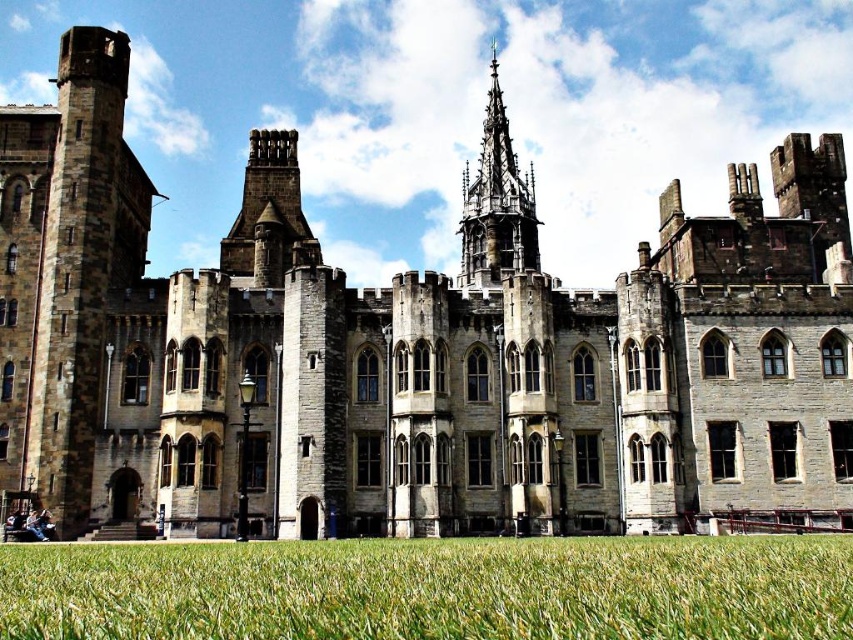
You are a knight standing on the green grass at lower center, looking towards the stone gothic tower at center. Which object is larger in size?

The stone gothic tower at center is larger than the green grass at lower center.

You are a knight standing on the green grass at lower center, looking towards the stone gothic tower at center. Which direction should you walk to get closer to the tower?

Since the green grass at lower center is in front of the stone gothic tower at center, you should walk forward towards the tower to get closer.